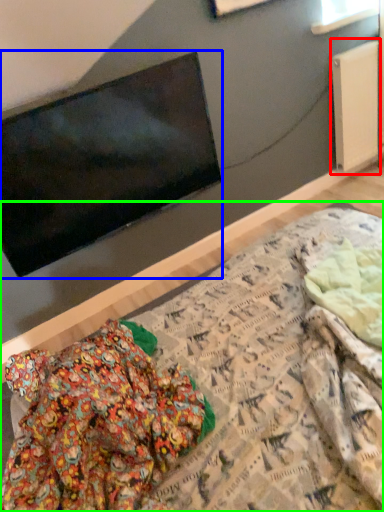
Question: Which object is the farthest from radiator (highlighted by a red box)? Choose among these: television (highlighted by a blue box) or bed (highlighted by a green box).

Choices:
 (A) television
 (B) bed

Answer: (B)